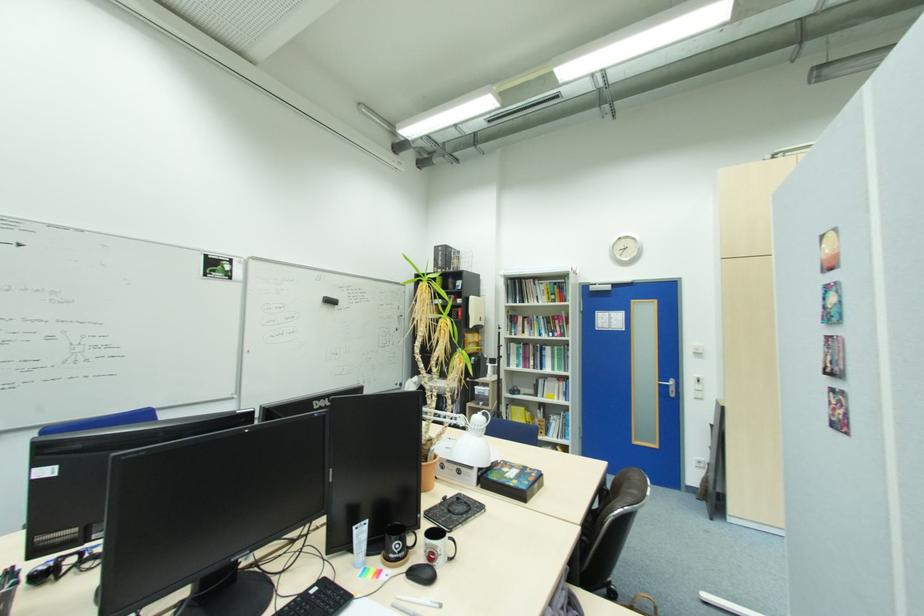
This screenshot has width=924, height=616. What are the coordinates of `black computer mouse` in the screenshot? It's located at (x=420, y=573).